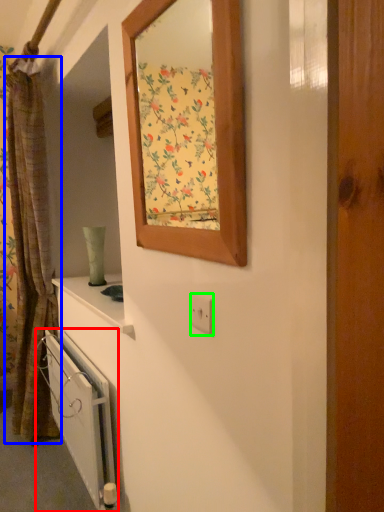
Question: Which is nearer to the radiator (highlighted by a red box)? curtain (highlighted by a blue box) or electric outlet (highlighted by a green box).

Choices:
 (A) curtain
 (B) electric outlet

Answer: (A)